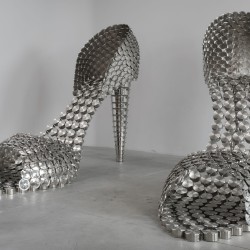
You are a GUI agent. You are given a task and a screenshot of the screen. Output one action in this format:
    pyautogui.click(x=<x>, y=<y>)
    Task: Click on the wall
    Image resolution: width=250 pixels, height=250 pixels.
    Given the screenshot: What is the action you would take?
    pyautogui.click(x=174, y=79)